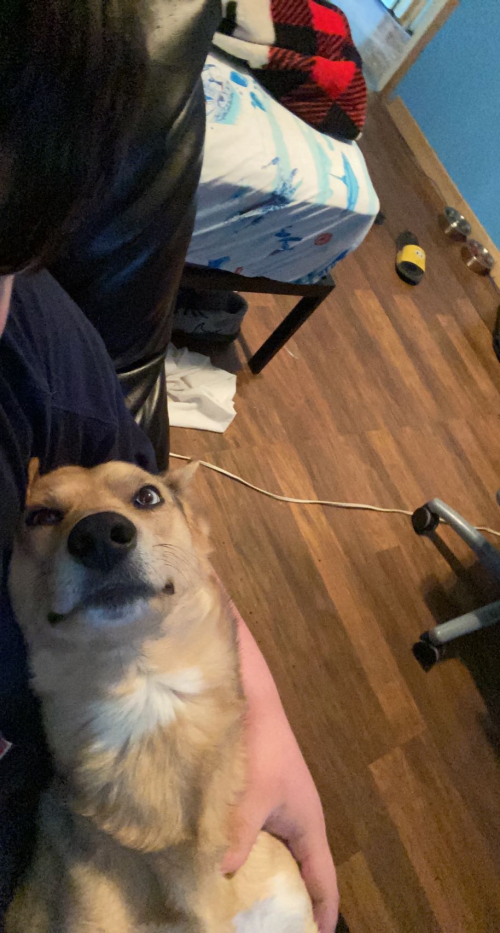
Image resolution: width=500 pixels, height=933 pixels. Identify the location of wood floor. (399, 822).